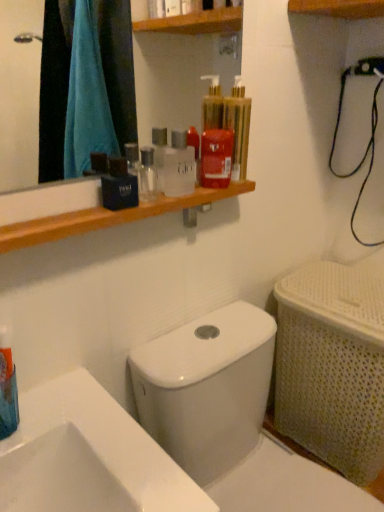
Question: Considering the relative positions of red glossy mouthwash at upper center, the 4th mouthwash in the bottom-to-top sequence, and wooden shelf at upper center in the image provided, is red glossy mouthwash at upper center, the 4th mouthwash in the bottom-to-top sequence, to the left of wooden shelf at upper center from the viewer's perspective?

Choices:
 (A) no
 (B) yes

Answer: (A)

Question: Is red glossy mouthwash at upper center, which is the fourth mouthwash in left-to-right order, at the right side of wooden shelf at upper center?

Choices:
 (A) no
 (B) yes

Answer: (B)

Question: From a real-world perspective, does red glossy mouthwash at upper center, the 4th mouthwash in the bottom-to-top sequence, stand above wooden shelf at upper center?

Choices:
 (A) yes
 (B) no

Answer: (A)

Question: Is red glossy mouthwash at upper center, which is the fourth mouthwash in left-to-right order, taller than wooden shelf at upper center?

Choices:
 (A) yes
 (B) no

Answer: (A)

Question: Is red glossy mouthwash at upper center, the second mouthwash positioned from the right, in front of wooden shelf at upper center?

Choices:
 (A) yes
 (B) no

Answer: (B)

Question: Considering the relative sizes of red glossy mouthwash at upper center, which is the fourth mouthwash in left-to-right order, and wooden shelf at upper center in the image provided, is red glossy mouthwash at upper center, which is the fourth mouthwash in left-to-right order, bigger than wooden shelf at upper center?

Choices:
 (A) no
 (B) yes

Answer: (A)

Question: From the image's perspective, does translucent plastic mouthwash at upper center, marked as the 1th mouthwash in a right-to-left arrangement, appear lower than transparent plastic mouthwash at upper center, the 3th mouthwash viewed from the top?

Choices:
 (A) no
 (B) yes

Answer: (A)

Question: Can you see translucent plastic mouthwash at upper center, positioned as the 1th mouthwash in top-to-bottom order, touching transparent plastic mouthwash at upper center, which is counted as the 3th mouthwash, starting from the right?

Choices:
 (A) no
 (B) yes

Answer: (A)

Question: Is translucent plastic mouthwash at upper center, marked as the 5th mouthwash in a left-to-right arrangement, wider than transparent plastic mouthwash at upper center, the 3th mouthwash viewed from the top?

Choices:
 (A) no
 (B) yes

Answer: (B)

Question: Is translucent plastic mouthwash at upper center, marked as the 1th mouthwash in a right-to-left arrangement, at the right side of transparent plastic mouthwash at upper center, which is counted as the 3th mouthwash, starting from the right?

Choices:
 (A) yes
 (B) no

Answer: (A)

Question: Are translucent plastic mouthwash at upper center, positioned as the 1th mouthwash in top-to-bottom order, and transparent plastic mouthwash at upper center, the 3th mouthwash viewed from the top, located far from each other?

Choices:
 (A) yes
 (B) no

Answer: (B)

Question: From the image's perspective, does translucent plastic mouthwash at upper center, marked as the 5th mouthwash in a left-to-right arrangement, appear higher than transparent plastic mouthwash at upper center, the 3th mouthwash viewed from the top?

Choices:
 (A) no
 (B) yes

Answer: (B)

Question: Does black matte bag at upper center, the 2th mouthwash from the left, lie behind transparent plastic mouthwash at upper center, the 3th mouthwash viewed from the top?

Choices:
 (A) yes
 (B) no

Answer: (B)